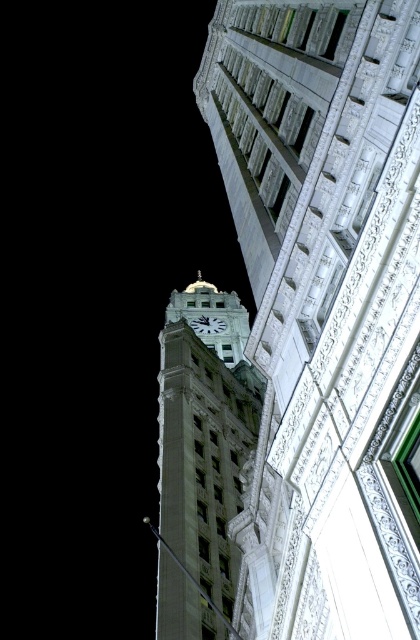
Is green copper clock tower at left positioned in front of white glossy clock at center?

Yes, green copper clock tower at left is in front of white glossy clock at center.

Is point (414, 560) closer to camera compared to point (210, 321)?

Yes, it is in front of point (210, 321).

What do you see at coordinates (325, 305) in the screenshot? I see `green copper clock tower at left` at bounding box center [325, 305].

The width and height of the screenshot is (420, 640). Find the location of `green copper clock tower at left`. green copper clock tower at left is located at coordinates (325, 305).

Can you confirm if green copper clock tower at left is shorter than white stone clock tower at center?

In fact, green copper clock tower at left may be taller than white stone clock tower at center.

The image size is (420, 640). I want to click on green copper clock tower at left, so tap(325, 305).

You are a GUI agent. You are given a task and a screenshot of the screen. Output one action in this format:
    pyautogui.click(x=<x>, y=<y>)
    Task: Click on the green copper clock tower at left
    Image resolution: width=420 pixels, height=640 pixels.
    Given the screenshot: What is the action you would take?
    pyautogui.click(x=325, y=305)

Can you confirm if white stone clock tower at center is taller than white glossy clock at center?

Yes, white stone clock tower at center is taller than white glossy clock at center.

Who is more distant from viewer, (226,321) or (202,321)?

Positioned behind is point (226,321).

Is point (207, 403) closer to viewer compared to point (210, 330)?

Yes, point (207, 403) is in front of point (210, 330).

I want to click on white stone clock tower at center, so click(204, 433).